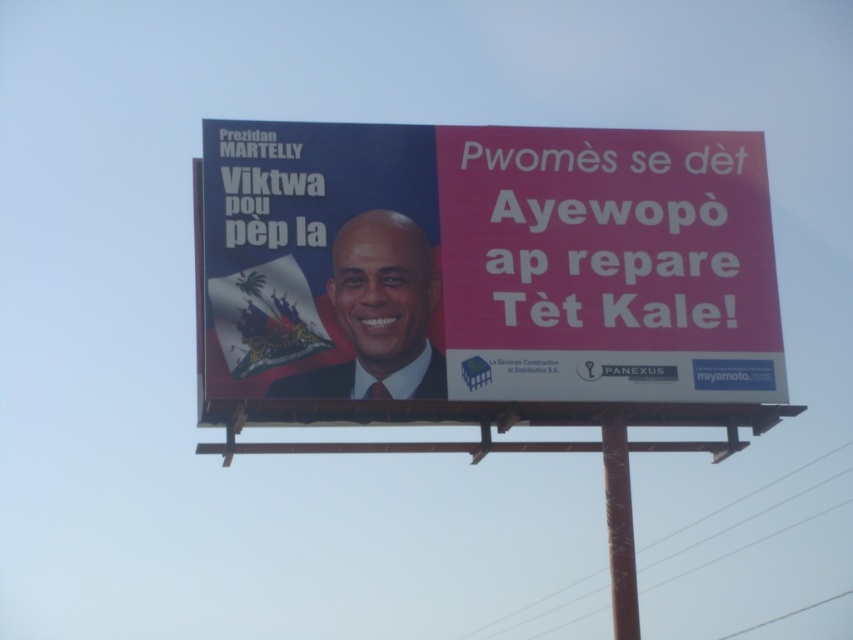
Does matte plastic billboard at center appear on the right side of smooth skin portrait at center?

Indeed, matte plastic billboard at center is positioned on the right side of smooth skin portrait at center.

Between point (436, 344) and point (405, 300), which one is positioned behind?

Point (405, 300)

Does point (612, 326) come behind point (410, 355)?

Yes, point (612, 326) is behind point (410, 355).

Locate an element on the screen. The height and width of the screenshot is (640, 853). matte plastic billboard at center is located at coordinates (488, 262).

Does matte plastic billboard at center have a greater width compared to metallic pole at center?

Yes, matte plastic billboard at center is wider than metallic pole at center.

Is the position of matte plastic billboard at center less distant than that of metallic pole at center?

Yes, it is.

This screenshot has height=640, width=853. Describe the element at coordinates (488, 262) in the screenshot. I see `matte plastic billboard at center` at that location.

Identify the location of matte plastic billboard at center. (488, 262).

Is smooth skin portrait at center positioned at the back of metallic pole at center?

No, smooth skin portrait at center is closer to the viewer.

Locate an element on the screen. The width and height of the screenshot is (853, 640). smooth skin portrait at center is located at coordinates (378, 314).